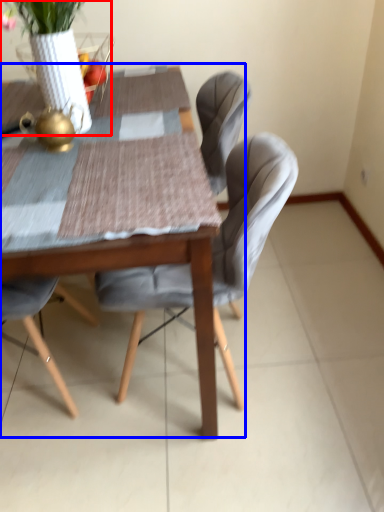
Question: Which object appears closest to the camera in this image, floral arrangement (highlighted by a red box) or kitchen & dining room table (highlighted by a blue box)?

Choices:
 (A) floral arrangement
 (B) kitchen & dining room table

Answer: (B)